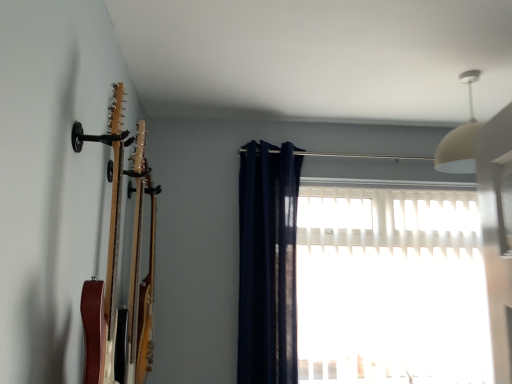
Question: From their relative heights in the image, would you say white translucent blinds at center is taller or shorter than navy blue fabric curtain at center?

Choices:
 (A) tall
 (B) short

Answer: (B)

Question: Visually, is white translucent blinds at center positioned to the left or to the right of navy blue fabric curtain at center?

Choices:
 (A) right
 (B) left

Answer: (A)

Question: Considering the real-world distances, which object is farthest from the white translucent blinds at center?

Choices:
 (A) navy blue fabric curtain at center
 (B) wooden acoustic guitar at left

Answer: (B)

Question: Which of these objects is positioned closest to the wooden acoustic guitar at left?

Choices:
 (A) navy blue fabric curtain at center
 (B) white translucent blinds at center

Answer: (A)